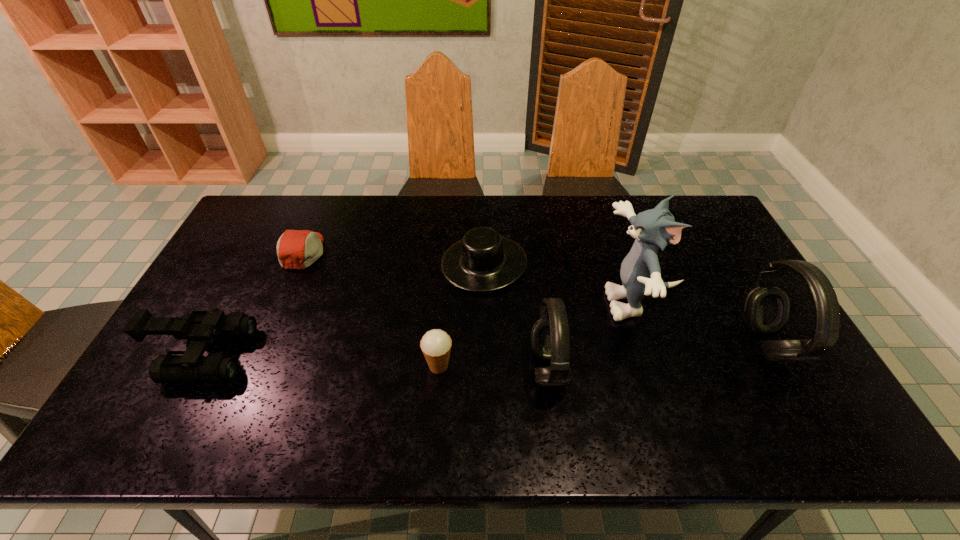
This screenshot has height=540, width=960. Find the location of `free area in between the taller headset and the sixth tallest object`. free area in between the taller headset and the sixth tallest object is located at coordinates (625, 303).

This screenshot has height=540, width=960. I want to click on free point between the icecream and the right headset, so click(x=603, y=355).

Locate which object ranks sixth in proximity to the binoculars. Please provide its 2D coordinates. Your answer should be formatted as a tuple, i.e. [(x, y)], where the tuple contains the x and y coordinates of a point satisfying the conditions above.

[(766, 308)]

Locate an element on the screen. This screenshot has width=960, height=540. the closest object to the dress hat is located at coordinates (550, 342).

At what (x,y) coordinates should I click in order to perform the action: click on vacant space that satisfies the following two spatial constraints: 1. on the front-facing side of the sixth object from left to right; 2. on the front side of the icecream. Please return your answer as a coordinate pair (x, y). The height and width of the screenshot is (540, 960). Looking at the image, I should click on (661, 366).